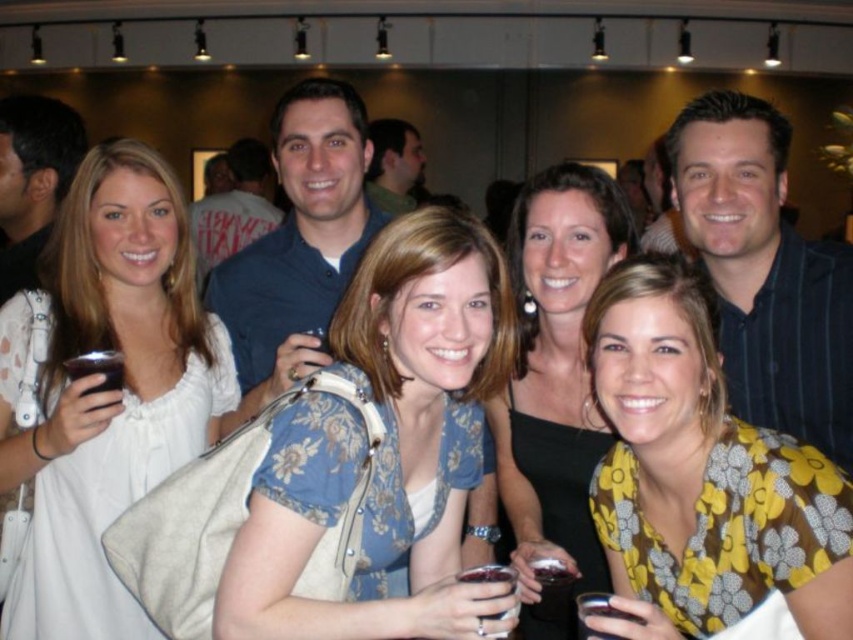
Who is more forward, [555,408] or [108,378]?

Point [108,378] is more forward.

Who is higher up, black fabric dress at center or matte plastic cup at lower left?

matte plastic cup at lower left is above.

Where is `black fabric dress at center`? black fabric dress at center is located at coordinates (555, 376).

Does translucent glass wine at lower center appear over matte plastic cup at lower left?

No, translucent glass wine at lower center is not above matte plastic cup at lower left.

Between point (538, 580) and point (119, 388), which one is positioned behind?

Positioned behind is point (119, 388).

The image size is (853, 640). I want to click on translucent glass wine at lower center, so coord(552,592).

Is point (576, 515) behind point (558, 595)?

Yes.

Who is more forward, [602,246] or [566,566]?

Point [566,566]

Is point (541, 516) positioned behind point (543, 573)?

Yes, point (541, 516) is farther from viewer.

You are a GUI agent. You are given a task and a screenshot of the screen. Output one action in this format:
    pyautogui.click(x=<x>, y=<y>)
    Task: Click on the black fabric dress at center
    
    Given the screenshot: What is the action you would take?
    pyautogui.click(x=555, y=376)